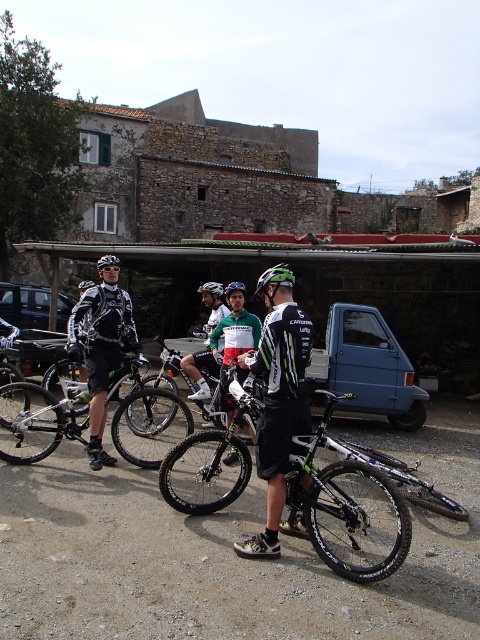
You are a photographer positioned at the edge of the scene. You want to capture a photo that includes both the black matte bicycle at center and the green matte bicycle helmet at center. Based on their positions, which object should you adjust your camera angle to include first if you want to frame them both without moving either object?

A: The black matte bicycle at center is to the left of the green matte bicycle helmet at center, so you should adjust your camera angle to include the black matte bicycle at center first on the left side before framing the green matte bicycle helmet at center on the right side.

You are standing at the point labeled point [36,349]. What object is located at this point?

The point [36,349] corresponds to the black matte car at center.

Looking at this image, you are a photographer standing in the middle of the scene. You want to take a photo of the black matte car at center and the black matte bicycle helmet at upper left. Which object will appear larger in the photo?

The black matte car at center will appear larger in the photo because it is closer to the photographer than the black matte bicycle helmet at upper left.